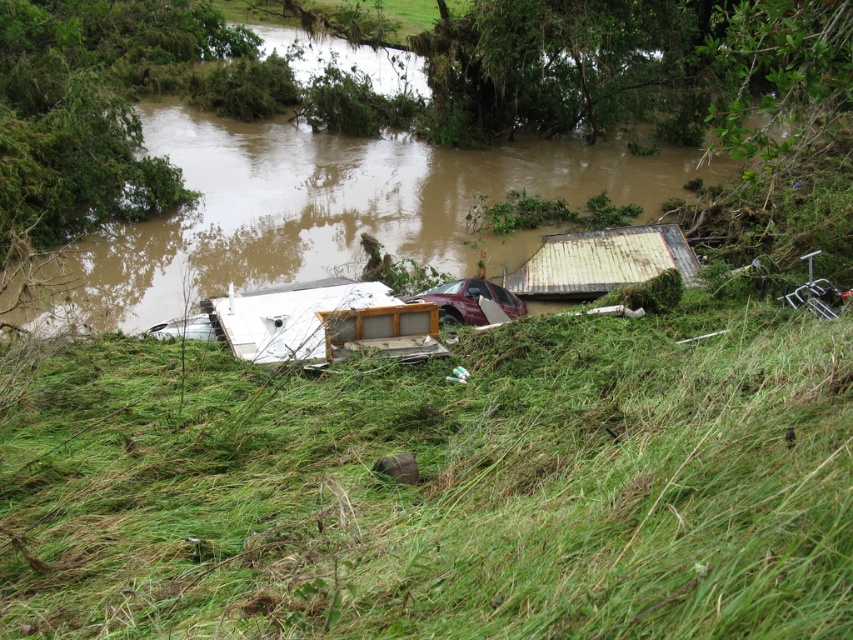
You are a rescue worker who needs to reach a stranded person located behind the white matte cabinet at center. Your boat can only travel 8 meters before needing to refuel. Do you think you can reach the person without refueling?

The distance between you and the white matte cabinet at center is 8.36 meters. Since your boat can only travel 8 meters before needing to refuel, you will need to refuel before reaching the person behind the white matte cabinet at center.

You are standing at the edge of the flooded area and see two points marked in the scene. The first point is at coordinates point [223,458] and the second is at point [341,348]. Which point is closer to your current position?

Point [223,458] is in front of point [341,348], so the first point is closer to your current position.